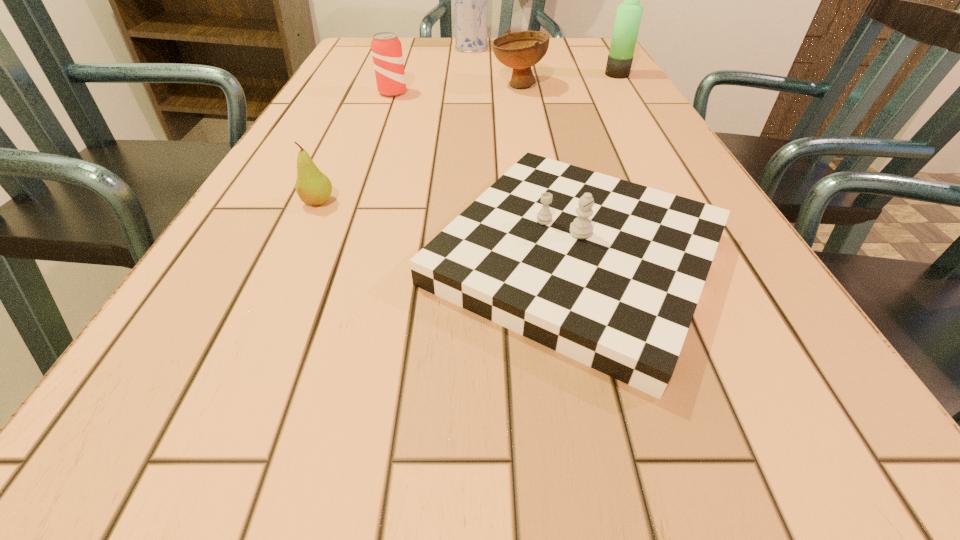
You are a GUI agent. You are given a task and a screenshot of the screen. Output one action in this format:
    pyautogui.click(x=<x>, y=<y>)
    Task: Click on the empty space that is in between the pear and the thermos bottle
    
    Given the screenshot: What is the action you would take?
    pyautogui.click(x=468, y=138)

Where is `the third closest object to the aerosol can`? the third closest object to the aerosol can is located at coordinates coord(629,13).

Choose which object is the nearest neighbor to the aerosol can. Please provide its 2D coordinates. Your answer should be formatted as a tuple, i.e. [(x, y)], where the tuple contains the x and y coordinates of a point satisfying the conditions above.

[(520, 50)]

This screenshot has height=540, width=960. Identify the location of blank space that satisfies the following two spatial constraints: 1. on the back side of the beer can; 2. on the right side of the aerosol can. 409,48.

Where is `vacant space that satisfies the following two spatial constraints: 1. on the front side of the checkerboard; 2. on the left side of the aerosol can`? Image resolution: width=960 pixels, height=540 pixels. vacant space that satisfies the following two spatial constraints: 1. on the front side of the checkerboard; 2. on the left side of the aerosol can is located at coordinates (462, 258).

What are the coordinates of `free location that satisfies the following two spatial constraints: 1. on the back side of the thermos bottle; 2. on the right side of the beer can` in the screenshot? It's located at (399, 75).

Where is `vacant space that satisfies the following two spatial constraints: 1. on the back side of the pear; 2. on the left side of the thermos bottle`? This screenshot has width=960, height=540. vacant space that satisfies the following two spatial constraints: 1. on the back side of the pear; 2. on the left side of the thermos bottle is located at coordinates (376, 75).

At what (x,y) coordinates should I click in order to perform the action: click on free spot that satisfies the following two spatial constraints: 1. on the front side of the beer can; 2. on the left side of the checkerboard. Please return your answer as a coordinate pair (x, y). Image resolution: width=960 pixels, height=540 pixels. Looking at the image, I should click on (333, 258).